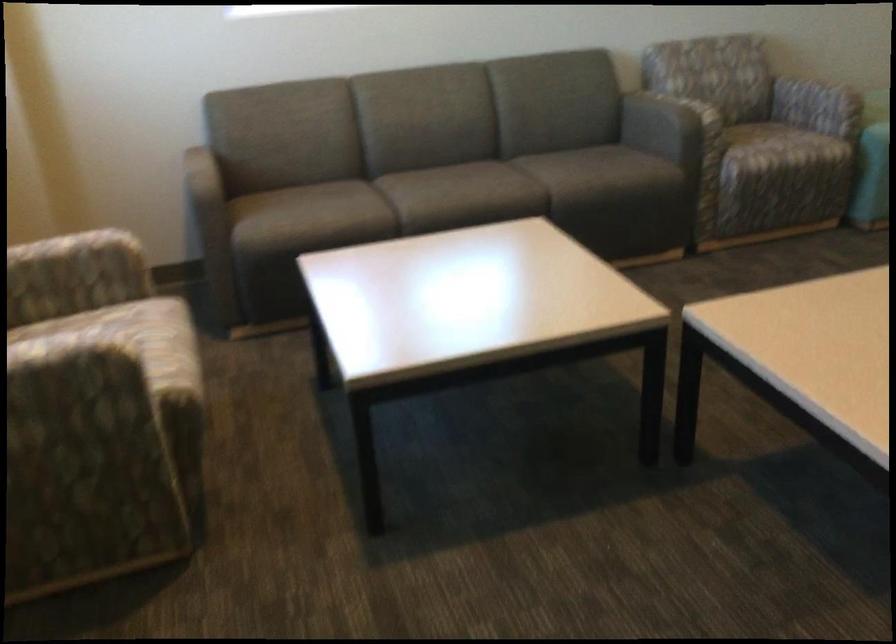
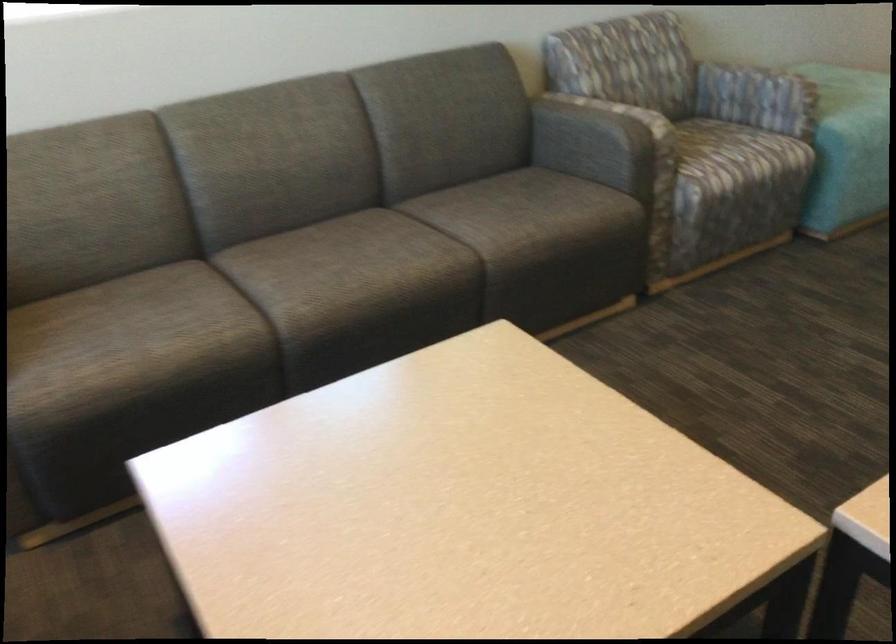
Where in the second image is the point corresponding to (x=794, y=93) from the first image?

(728, 84)